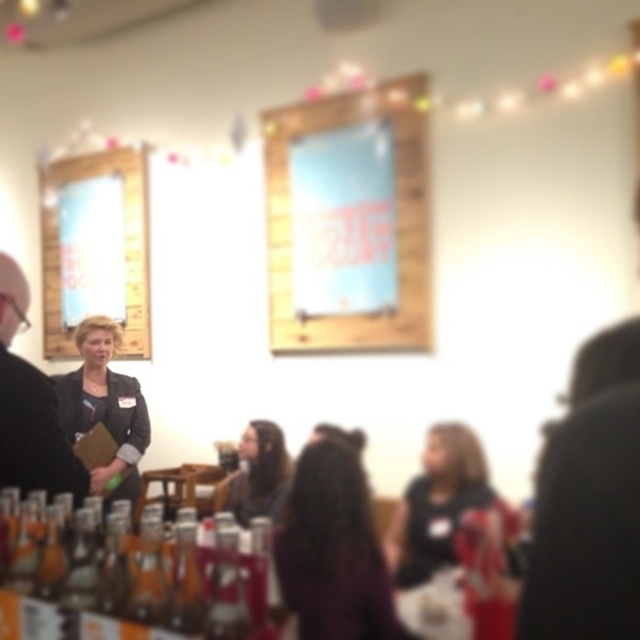
Looking at this image, who is lower down, black fabric coat at right or long brown hair at center?

long brown hair at center is below.

Between black fabric coat at right and long brown hair at center, which one has less height?

black fabric coat at right is shorter.

Is point (630, 355) behind point (227, 493)?

No.

The height and width of the screenshot is (640, 640). I want to click on black fabric coat at right, so click(x=589, y=500).

Between point (448, 464) and point (170, 474), which one is positioned in front?

Point (448, 464) is more forward.

In the scene shown: Does matte black shirt at center have a lesser height compared to wooden table at center?

No.

The image size is (640, 640). I want to click on matte black shirt at center, so [438, 502].

Does black fabric coat at right have a smaller size compared to matte black blazer at center?

Correct, black fabric coat at right occupies less space than matte black blazer at center.

Does black fabric coat at right appear on the right side of matte black blazer at center?

Indeed, black fabric coat at right is positioned on the right side of matte black blazer at center.

At what (x,y) coordinates should I click in order to perform the action: click on black fabric coat at right. Please return your answer as a coordinate pair (x, y). The image size is (640, 640). Looking at the image, I should click on (589, 500).